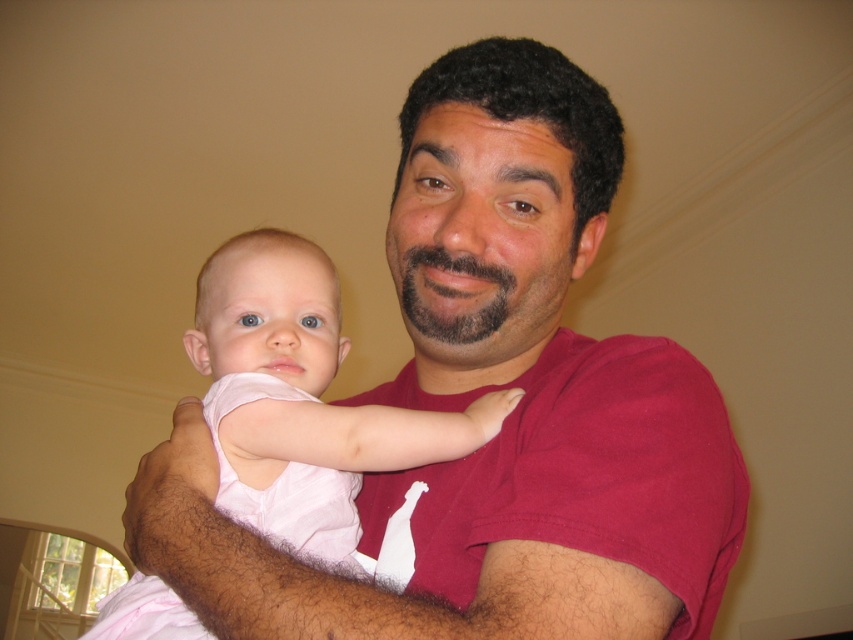
Question: Is pink fabric at center to the left of pink fabric baby at center from the viewer's perspective?

Choices:
 (A) yes
 (B) no

Answer: (B)

Question: Estimate the real-world distances between objects in this image. Which object is closer to the pink fabric at center?

Choices:
 (A) matte red shirt at center
 (B) pink fabric baby at center

Answer: (A)

Question: Based on their relative distances, which object is nearer to the pink fabric at center?

Choices:
 (A) matte red shirt at center
 (B) pink fabric baby at center

Answer: (A)

Question: Is the position of matte red shirt at center more distant than that of pink fabric baby at center?

Choices:
 (A) yes
 (B) no

Answer: (B)

Question: Can you confirm if matte red shirt at center is positioned above pink fabric at center?

Choices:
 (A) no
 (B) yes

Answer: (B)

Question: Considering the real-world distances, which object is closest to the pink fabric baby at center?

Choices:
 (A) matte red shirt at center
 (B) pink fabric at center

Answer: (B)